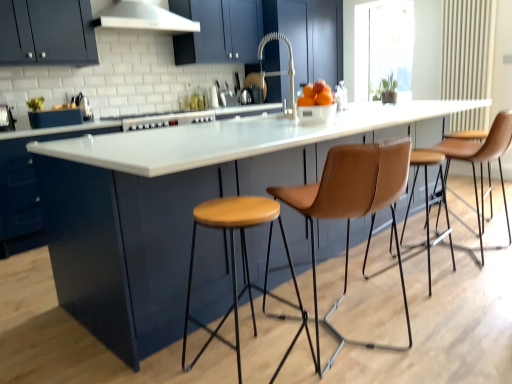
Question: Does transparent glass window at upper right touch brown leather stool at right, which ranks as the second chair in left-to-right order?

Choices:
 (A) yes
 (B) no

Answer: (B)

Question: Can you confirm if transparent glass window at upper right is taller than brown leather stool at right, which ranks as the second chair in left-to-right order?

Choices:
 (A) yes
 (B) no

Answer: (A)

Question: Considering the relative sizes of transparent glass window at upper right and brown leather stool at right, the first chair in the right-to-left sequence, in the image provided, is transparent glass window at upper right thinner than brown leather stool at right, the first chair in the right-to-left sequence,?

Choices:
 (A) no
 (B) yes

Answer: (B)

Question: Considering the relative positions of transparent glass window at upper right and brown leather stool at right, acting as the 1th chair starting from the back, in the image provided, is transparent glass window at upper right to the left of brown leather stool at right, acting as the 1th chair starting from the back, from the viewer's perspective?

Choices:
 (A) no
 (B) yes

Answer: (A)

Question: Does transparent glass window at upper right lie behind brown leather stool at right, acting as the 1th chair starting from the back?

Choices:
 (A) no
 (B) yes

Answer: (B)

Question: Based on their sizes in the image, would you say orange matte at center is bigger or smaller than white glossy countertop at center, which appears as the second cabinetry when viewed from the top?

Choices:
 (A) big
 (B) small

Answer: (B)

Question: From the image's perspective, is orange matte at center above or below white glossy countertop at center, the first cabinetry in the bottom-to-top sequence?

Choices:
 (A) below
 (B) above

Answer: (B)

Question: Is orange matte at center wider or thinner than white glossy countertop at center, the first cabinetry in the bottom-to-top sequence?

Choices:
 (A) wide
 (B) thin

Answer: (B)

Question: Is orange matte at center in front of or behind white glossy countertop at center, the first cabinetry in the bottom-to-top sequence, in the image?

Choices:
 (A) behind
 (B) front

Answer: (B)

Question: From a real-world perspective, relative to white matte exhaust hood at upper center, is matte dark blue cabinet at upper left, which is the 1th cabinetry in top-to-bottom order, vertically above or below?

Choices:
 (A) above
 (B) below

Answer: (B)

Question: In terms of height, does matte dark blue cabinet at upper left, which is the 2th cabinetry from bottom to top, look taller or shorter compared to white matte exhaust hood at upper center?

Choices:
 (A) tall
 (B) short

Answer: (A)

Question: Considering the relative positions of matte dark blue cabinet at upper left, which is the 2th cabinetry from bottom to top, and white matte exhaust hood at upper center in the image provided, is matte dark blue cabinet at upper left, which is the 2th cabinetry from bottom to top, to the left or to the right of white matte exhaust hood at upper center?

Choices:
 (A) left
 (B) right

Answer: (A)

Question: Is matte dark blue cabinet at upper left, which is the 1th cabinetry in top-to-bottom order, in front of or behind white matte exhaust hood at upper center in the image?

Choices:
 (A) front
 (B) behind

Answer: (A)

Question: Considering the positions of point (24, 13) and point (306, 324), is point (24, 13) closer or farther from the camera than point (306, 324)?

Choices:
 (A) closer
 (B) farther

Answer: (B)

Question: Is matte dark blue cabinet at upper left, which is the 1th cabinetry in top-to-bottom order, inside the boundaries of wooden/matte stool at center, or outside?

Choices:
 (A) outside
 (B) inside

Answer: (A)